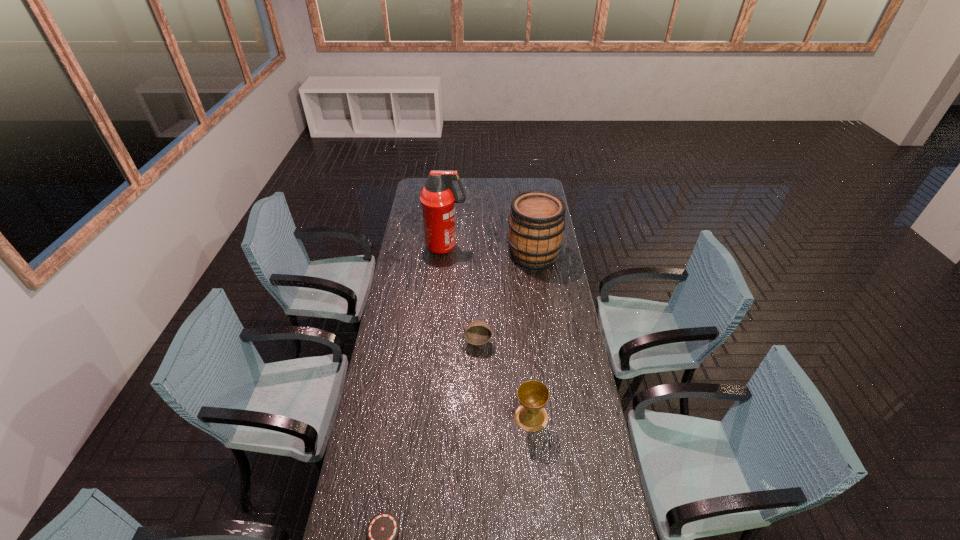
Point out which object is positioned as the second nearest to the cider. Please provide its 2D coordinates. Your answer should be formatted as a tuple, i.e. [(x, y)], where the tuple contains the x and y coordinates of a point satisfying the conditions above.

[(477, 332)]

Identify which object is the third closest to the third farthest object. Please provide its 2D coordinates. Your answer should be formatted as a tuple, i.e. [(x, y)], where the tuple contains the x and y coordinates of a point satisfying the conditions above.

[(438, 197)]

The width and height of the screenshot is (960, 540). I want to click on vacant space that satisfies the following two spatial constraints: 1. on the trigger side of the tallest object; 2. on the left side of the third tallest object, so click(x=430, y=417).

Find the location of `vacant region that satisfies the following two spatial constraints: 1. on the front side of the chalice; 2. on the right side of the third object from right to left`. vacant region that satisfies the following two spatial constraints: 1. on the front side of the chalice; 2. on the right side of the third object from right to left is located at coordinates coord(478,417).

This screenshot has height=540, width=960. Find the location of `free space that satisfies the following two spatial constraints: 1. on the back side of the cider; 2. on the right side of the second nearest object`. free space that satisfies the following two spatial constraints: 1. on the back side of the cider; 2. on the right side of the second nearest object is located at coordinates (516, 254).

Where is `vacant point that satisfies the following two spatial constraints: 1. on the trigger side of the chalice; 2. on the left side of the fire extinguisher`? vacant point that satisfies the following two spatial constraints: 1. on the trigger side of the chalice; 2. on the left side of the fire extinguisher is located at coordinates (430, 417).